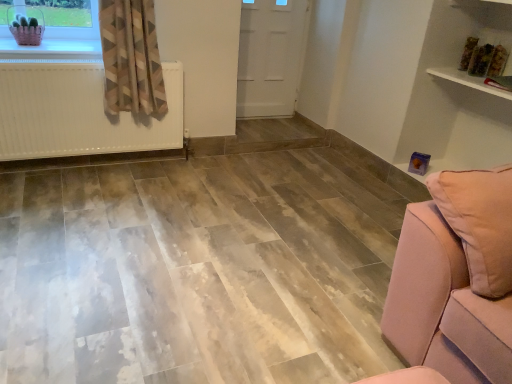
Question: From a real-world perspective, is white matte radiator at left positioned above or below matte plastic basket at upper left?

Choices:
 (A) above
 (B) below

Answer: (B)

Question: Is white matte radiator at left bigger or smaller than matte plastic basket at upper left?

Choices:
 (A) big
 (B) small

Answer: (A)

Question: Estimate the real-world distances between objects in this image. Which object is farther from the geometric-patterned fabric curtain at left?

Choices:
 (A) matte plastic basket at upper left
 (B) white matte radiator at left
 (C) white glossy shelf at upper right
 (D) white matte door at center

Answer: (C)

Question: Estimate the real-world distances between objects in this image. Which object is farther from the geometric-patterned fabric curtain at left?

Choices:
 (A) white matte radiator at left
 (B) matte plastic basket at upper left
 (C) white matte door at center
 (D) white glossy shelf at upper right

Answer: (D)